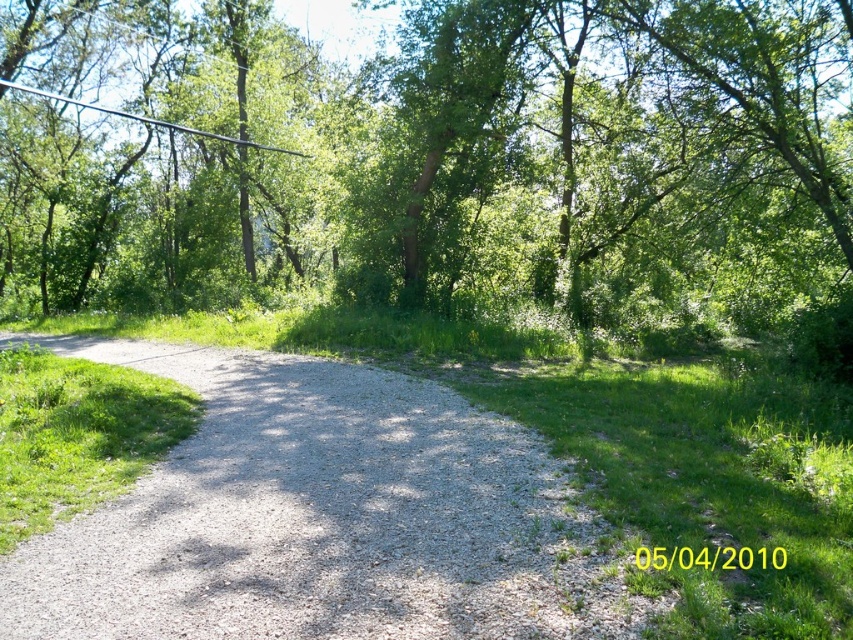
Looking at this image, which of these two, green leafy tree at upper center or metallic wire at upper left, stands taller?

green leafy tree at upper center

Which is below, green leafy tree at upper center or metallic wire at upper left?

green leafy tree at upper center

Is point (405, 28) farther from viewer compared to point (48, 93)?

That is False.

Locate an element on the screen. The height and width of the screenshot is (640, 853). green leafy tree at upper center is located at coordinates (436, 161).

Between green leafy tree at upper center and gray gravel path at center, which one is positioned higher?

Positioned higher is green leafy tree at upper center.

At what (x,y) coordinates should I click in order to perform the action: click on green leafy tree at upper center. Please return your answer as a coordinate pair (x, y). This screenshot has width=853, height=640. Looking at the image, I should click on (436, 161).

Consider the image. Between gray gravel path at center and metallic wire at upper left, which one is positioned lower?

gray gravel path at center

Does gray gravel path at center appear on the right side of metallic wire at upper left?

Yes, gray gravel path at center is to the right of metallic wire at upper left.

What do you see at coordinates (321, 516) in the screenshot? I see `gray gravel path at center` at bounding box center [321, 516].

Image resolution: width=853 pixels, height=640 pixels. I want to click on gray gravel path at center, so click(321, 516).